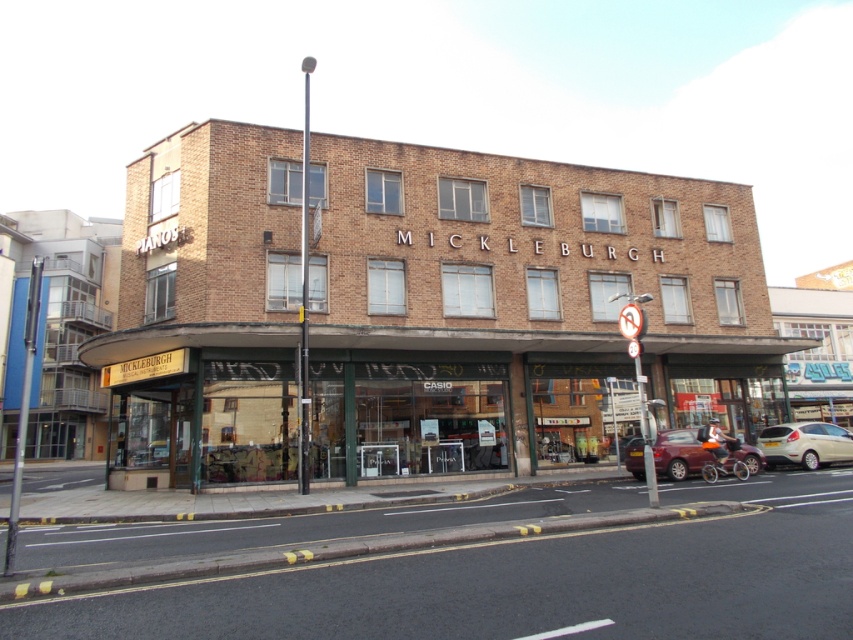
Question: Does brown brick building at center lie behind metallic circular sign at right?

Choices:
 (A) yes
 (B) no

Answer: (A)

Question: Among these objects, which one is farthest from the camera?

Choices:
 (A) matte red car at lower right
 (B) metallic circular sign at right
 (C) white matte car at lower right
 (D) brown brick building at center

Answer: (C)

Question: Which of the following is the farthest from the observer?

Choices:
 (A) (660, 460)
 (B) (838, 460)
 (C) (627, 316)

Answer: (B)

Question: Does white matte car at lower right appear on the right side of metallic circular sign at right?

Choices:
 (A) yes
 (B) no

Answer: (A)

Question: Which object is closer to the camera taking this photo?

Choices:
 (A) metallic circular sign at right
 (B) brown brick building at center
 (C) matte red car at lower right

Answer: (A)

Question: Is matte red car at lower right bigger than metallic circular sign at right?

Choices:
 (A) no
 (B) yes

Answer: (A)